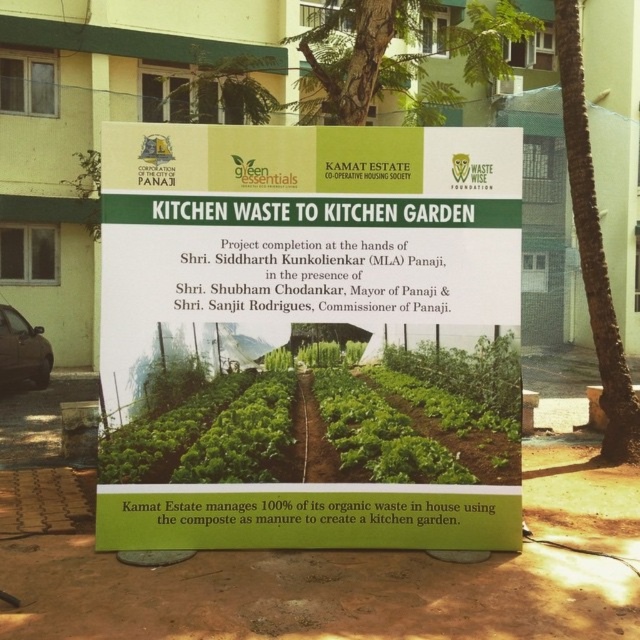
Question: Does green leafy vegetables at center have a greater width compared to green leafy tree at upper center?

Choices:
 (A) yes
 (B) no

Answer: (A)

Question: Which point appears farthest from the camera in this image?

Choices:
 (A) (628, 387)
 (B) (360, 97)

Answer: (B)

Question: Is green leafy vegetables at center above green leafy tree at upper center?

Choices:
 (A) yes
 (B) no

Answer: (B)

Question: Among these objects, which one is nearest to the camera?

Choices:
 (A) green bark tree at center
 (B) green leafy tree at upper center
 (C) green leafy vegetables at center

Answer: (C)

Question: Does green leafy vegetables at center appear on the right side of green leafy tree at upper center?

Choices:
 (A) no
 (B) yes

Answer: (A)

Question: Which point appears closest to the camera in this image?

Choices:
 (A) (461, 45)
 (B) (324, 412)
 (C) (608, 369)

Answer: (B)